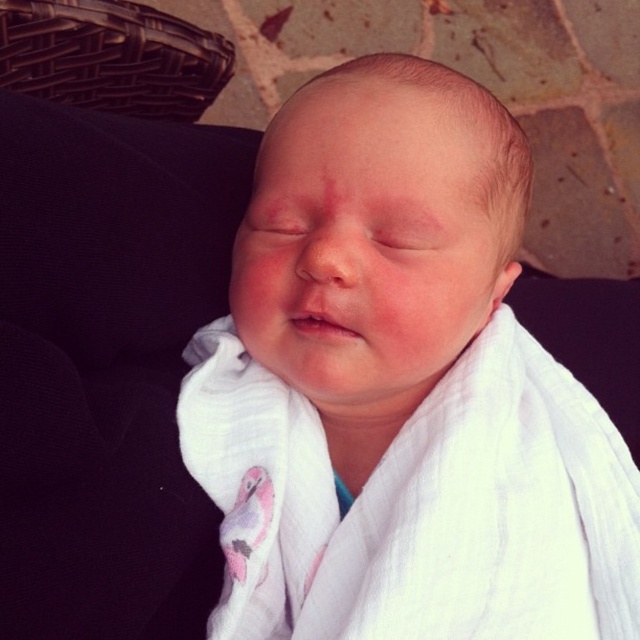
How distant is white muslin cloth at center from brown woven basket at upper left?

17.90 inches

Who is more forward, (444, 435) or (97, 61)?

Positioned in front is point (444, 435).

Where is `white muslin cloth at center`? This screenshot has height=640, width=640. white muslin cloth at center is located at coordinates (419, 502).